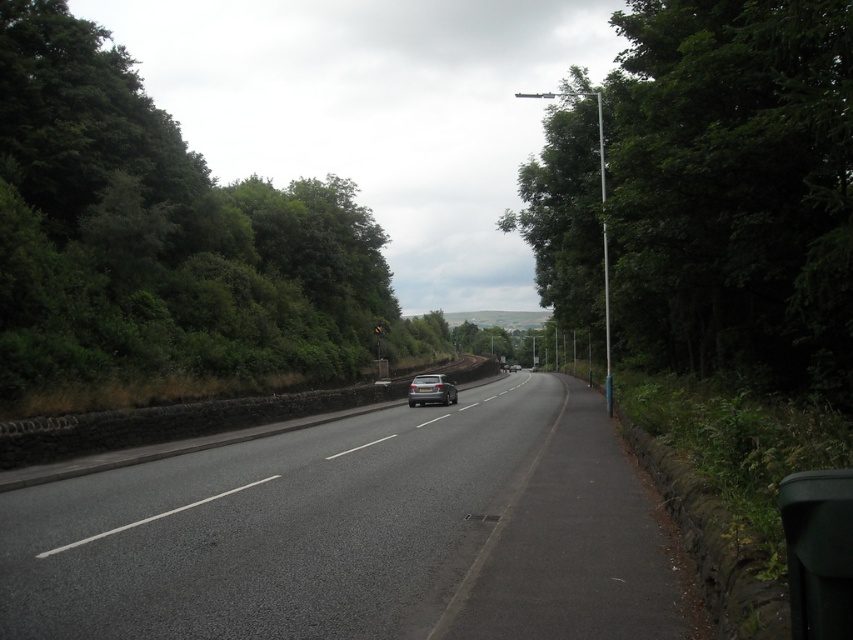
Question: Which object is the closest to the satin black car at center?

Choices:
 (A) green leafy trees at left
 (B) black asphalt highway at center

Answer: (B)

Question: From the image, what is the correct spatial relationship of black asphalt highway at center in relation to green leafy tree at right?

Choices:
 (A) left
 (B) right

Answer: (A)

Question: Where is black asphalt highway at center located in relation to green leafy trees at left in the image?

Choices:
 (A) below
 (B) above

Answer: (A)

Question: Which of these objects is positioned farthest from the black asphalt highway at center?

Choices:
 (A) green leafy tree at right
 (B) green leafy trees at left
 (C) satin black car at center

Answer: (B)

Question: Which point appears farthest from the camera in this image?

Choices:
 (A) (838, 179)
 (B) (437, 397)
 (C) (537, 566)
 (D) (306, 307)

Answer: (D)

Question: Does green leafy tree at right appear over satin black car at center?

Choices:
 (A) no
 (B) yes

Answer: (B)